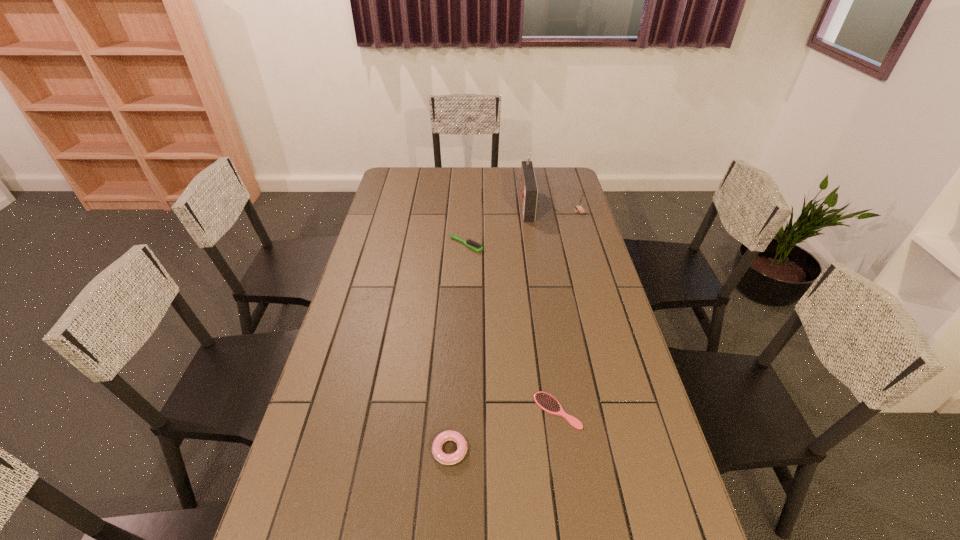
The width and height of the screenshot is (960, 540). I want to click on vacant space situated on the front panel of the tallest object, so click(x=463, y=205).

I want to click on vacant space located 0.110m on the back of the rightmost object, so click(x=574, y=194).

Find the location of a particular element. The height and width of the screenshot is (540, 960). vacant region located 0.100m on the left of the farther hairbrush is located at coordinates (424, 245).

Where is `vacant space located 0.290m on the left of the nearest object`? The image size is (960, 540). vacant space located 0.290m on the left of the nearest object is located at coordinates (316, 450).

This screenshot has height=540, width=960. Find the location of `free space located 0.340m on the left of the right hairbrush`. free space located 0.340m on the left of the right hairbrush is located at coordinates (408, 410).

Where is `object present at the far edge`? The width and height of the screenshot is (960, 540). object present at the far edge is located at coordinates (528, 187).

Locate an element on the screen. This screenshot has width=960, height=540. object positioned at the right edge is located at coordinates (579, 207).

Locate an element on the screen. free location at the far edge is located at coordinates (464, 168).

You are a GUI agent. You are given a task and a screenshot of the screen. Output one action in this format:
    pyautogui.click(x=<x>, y=<y>)
    Task: Click on the free space at the left edge
    
    Given the screenshot: What is the action you would take?
    pyautogui.click(x=374, y=296)

The height and width of the screenshot is (540, 960). I want to click on free spot at the right edge of the desktop, so click(607, 448).